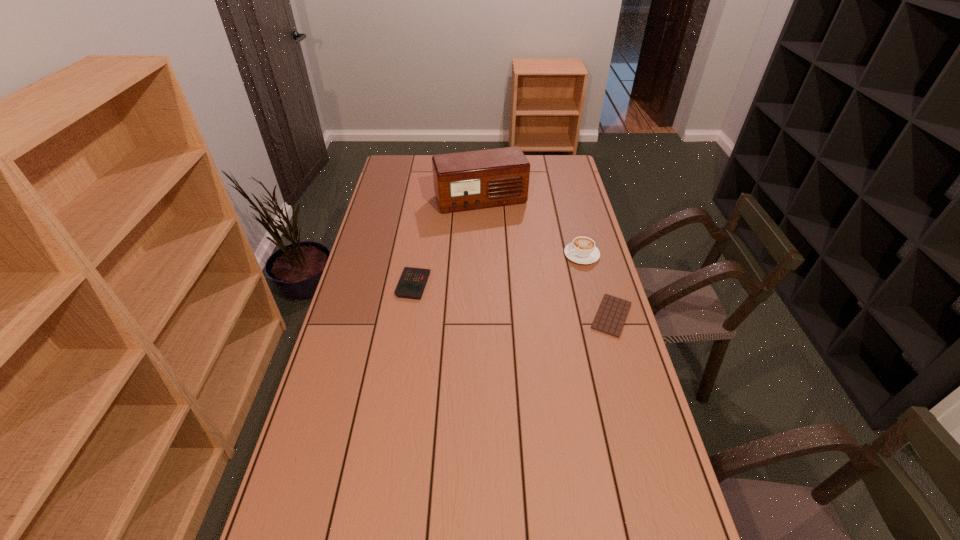
Where is `vacant space at the far left corner`? The width and height of the screenshot is (960, 540). vacant space at the far left corner is located at coordinates (387, 170).

In the image, there is a desktop. Identify the location of vacant space at the near left corner. (282, 505).

You are a GUI agent. You are given a task and a screenshot of the screen. Output one action in this format:
    pyautogui.click(x=<x>, y=<y>)
    Task: Click on the vacant area at the far right corner of the desktop
    This screenshot has width=960, height=540.
    Given the screenshot: What is the action you would take?
    pyautogui.click(x=563, y=163)

Locate an element on the screen. The width and height of the screenshot is (960, 540). free region at the near right corner of the desktop is located at coordinates [663, 537].

Locate an element on the screen. free area in between the third shortest object and the second shortest object is located at coordinates (497, 269).

At what (x,y) coordinates should I click in order to perform the action: click on unoccupied position between the second shortest object and the radio receiver. Please return your answer as a coordinate pair (x, y). Looking at the image, I should click on (446, 242).

The height and width of the screenshot is (540, 960). Identify the location of vacant space in between the shortest object and the farthest object. (546, 258).

Find the location of `blank region between the shortest object and the second tallest object`. blank region between the shortest object and the second tallest object is located at coordinates (596, 285).

The width and height of the screenshot is (960, 540). Identify the location of free space that is in between the third nearest object and the chocolate bar. (596, 285).

This screenshot has height=540, width=960. I want to click on unoccupied position between the second farthest object and the shortest object, so click(596, 285).